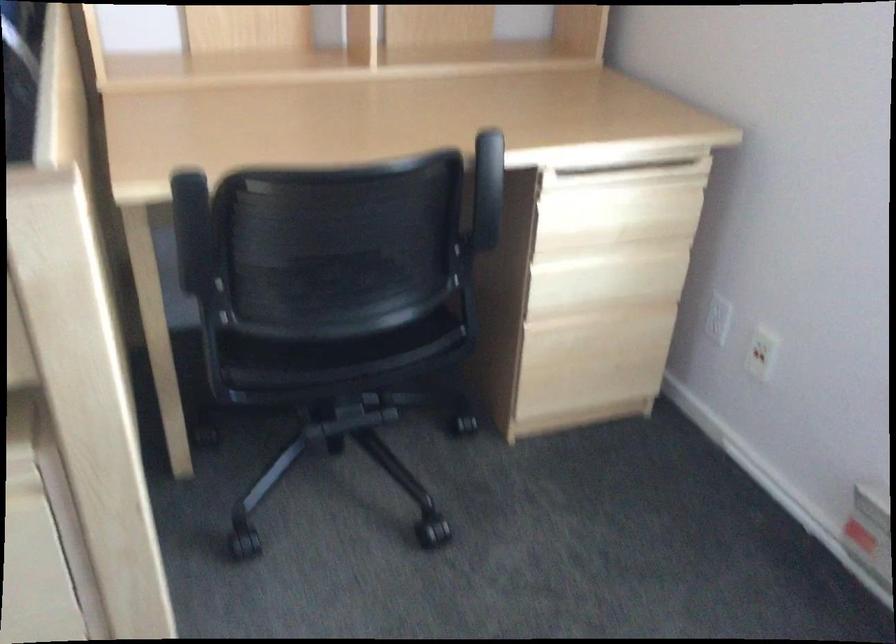
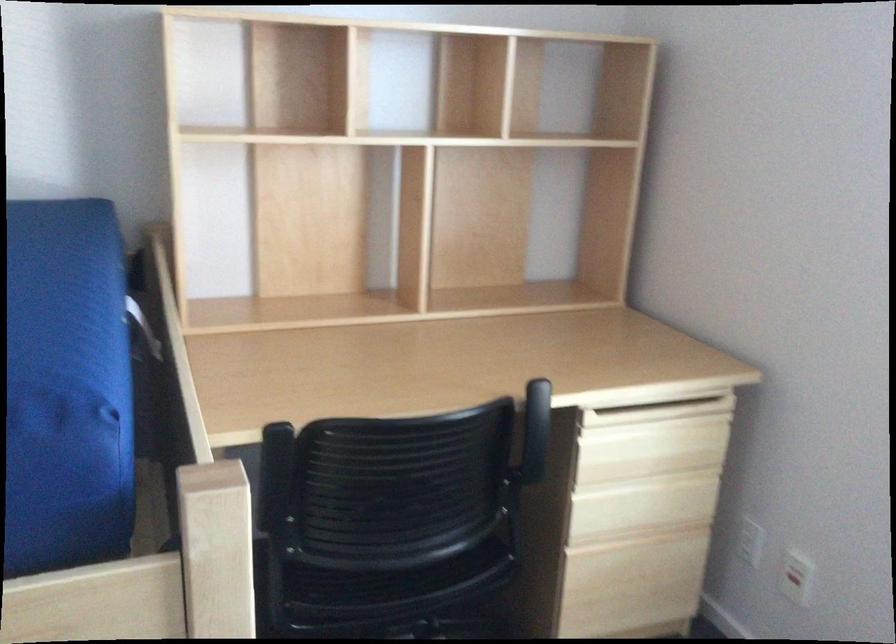
Locate, in the second image, the point that corresponds to (606,279) in the first image.

(642, 506)